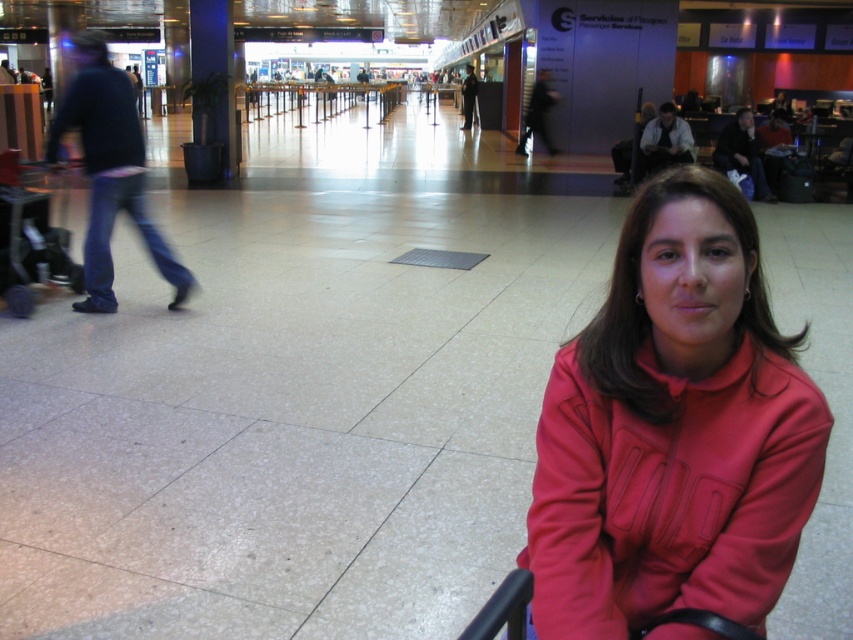
You are a photographer setting up a shoot in the airport terminal. You need to place a 1.2 meter wide backdrop behind the two subjects. The backdrop must be positioned so that it doesn not block either the matte red jacket at lower right or the jeans at left. Given the spatial relationship between the two objects, where should you place the backdrop?

The matte red jacket at lower right is narrower than the jeans at left. To avoid blocking either, position the backdrop behind the jeans at left since it is wider and will provide a better coverage area without overlapping the smaller jacket.

You are a photographer standing in the airport terminal. You want to take a photo of the matte red jacket at lower right and the jeans at left. Which object should you adjust your camera angle to focus on first if you are facing the scene from the front?

The jeans at left should be focused on first since the matte red jacket at lower right is to the right of the jeans at left, meaning the jeans are closer to your left side when facing the scene.

You are a photographer standing in the airport terminal and want to take a photo of the matte red jacket at lower right and the jeans at left. Which object should you focus on first if you want to capture both in the same frame without moving the camera?

The matte red jacket at lower right is much taller than the jeans at left, so you should focus on the taller matte red jacket at lower right first to ensure both are in focus.